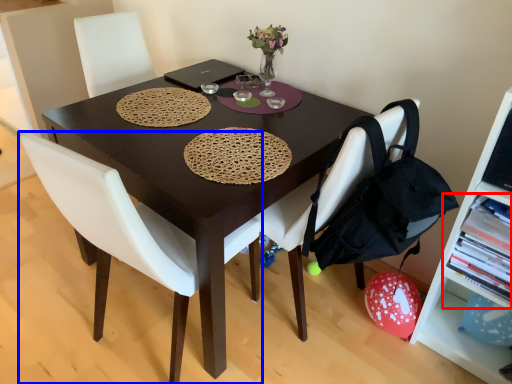
Question: Which point is further to the camera, shelf (highlighted by a red box) or chair (highlighted by a blue box)?

Choices:
 (A) shelf
 (B) chair

Answer: (A)